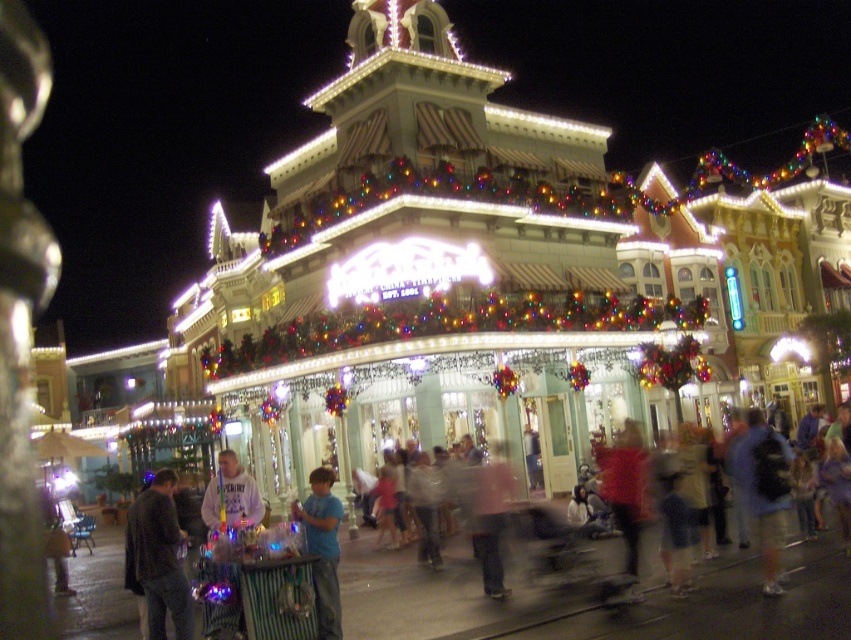
You are standing at the entrance of the festive building and need to reach a friend who is holding the blue cotton shirt at center. There is a blue backpack at lower right blocking the path. Can you walk around it? Explain why or why not based on the distance between them.

The blue backpack at lower right and blue cotton shirt at center are 29.87 meters apart. Since the distance between them is quite large, you can easily walk around the blue backpack at lower right to reach your friend holding the blue cotton shirt at center without any difficulty.

You are an event planner at the festive market and need to arrange decorations. You have a blue cotton shirt at center and a pink fabric at center. Which item should you move to the right to align them centrally?

The blue cotton shirt at center is positioned on the left side of the pink fabric at center. To align them centrally, you should move the blue cotton shirt at center to the right so it is centered with the pink fabric at center.

You are standing at the entrance of the festive building and see the blue cotton shirt at center. Can you determine if the shirt is positioned to the left or right of the building?

The blue cotton shirt at center is located at point 0.856 on the x and 0.380 on the y coordinates. Since the x value is closer to 1, it is positioned to the right of the building.